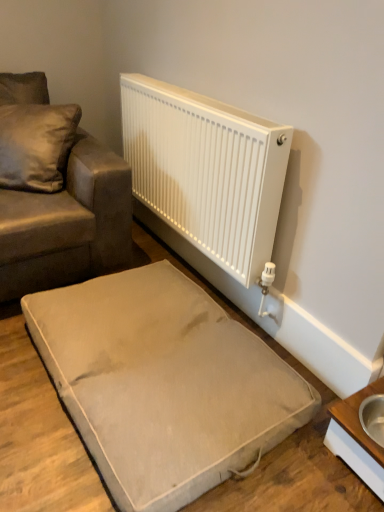
Question: From the image's perspective, is satin cushion at upper left located above beige fabric dog bed at lower center?

Choices:
 (A) yes
 (B) no

Answer: (A)

Question: Considering the relative positions of satin cushion at upper left and beige fabric dog bed at lower center in the image provided, is satin cushion at upper left in front of beige fabric dog bed at lower center?

Choices:
 (A) yes
 (B) no

Answer: (B)

Question: From a real-world perspective, is satin cushion at upper left on beige fabric dog bed at lower center?

Choices:
 (A) no
 (B) yes

Answer: (B)

Question: From a real-world perspective, is satin cushion at upper left located beneath beige fabric dog bed at lower center?

Choices:
 (A) no
 (B) yes

Answer: (A)

Question: Is satin cushion at upper left bigger than beige fabric dog bed at lower center?

Choices:
 (A) no
 (B) yes

Answer: (A)

Question: Relative to white wood table at lower right, is satin brown couch at upper left in front or behind?

Choices:
 (A) behind
 (B) front

Answer: (A)

Question: Looking at the image, does satin brown couch at upper left seem bigger or smaller compared to white wood table at lower right?

Choices:
 (A) big
 (B) small

Answer: (A)

Question: In the image, is satin brown couch at upper left on the left side or the right side of white wood table at lower right?

Choices:
 (A) left
 (B) right

Answer: (A)

Question: Considering the positions of point (77, 204) and point (370, 475), is point (77, 204) closer or farther from the camera than point (370, 475)?

Choices:
 (A) closer
 (B) farther

Answer: (B)

Question: Is point (62, 105) positioned closer to the camera than point (223, 325)?

Choices:
 (A) closer
 (B) farther

Answer: (B)

Question: Is satin cushion at upper left situated inside beige fabric dog bed at lower center or outside?

Choices:
 (A) inside
 (B) outside

Answer: (B)

Question: Looking at their shapes, would you say satin cushion at upper left is wider or thinner than beige fabric dog bed at lower center?

Choices:
 (A) wide
 (B) thin

Answer: (B)

Question: Looking at the image, does satin cushion at upper left seem bigger or smaller compared to beige fabric dog bed at lower center?

Choices:
 (A) big
 (B) small

Answer: (B)

Question: From a real-world perspective, is satin cushion at upper left above or below white wood table at lower right?

Choices:
 (A) above
 (B) below

Answer: (A)

Question: Do you think satin cushion at upper left is within white wood table at lower right, or outside of it?

Choices:
 (A) outside
 (B) inside

Answer: (A)